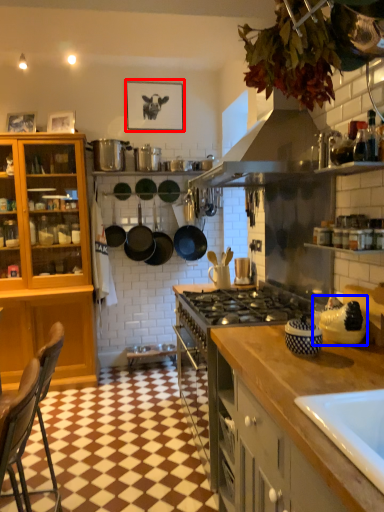
Question: Which object appears farthest to the camera in this image, picture frame (highlighted by a red box) or appliance (highlighted by a blue box)?

Choices:
 (A) picture frame
 (B) appliance

Answer: (A)